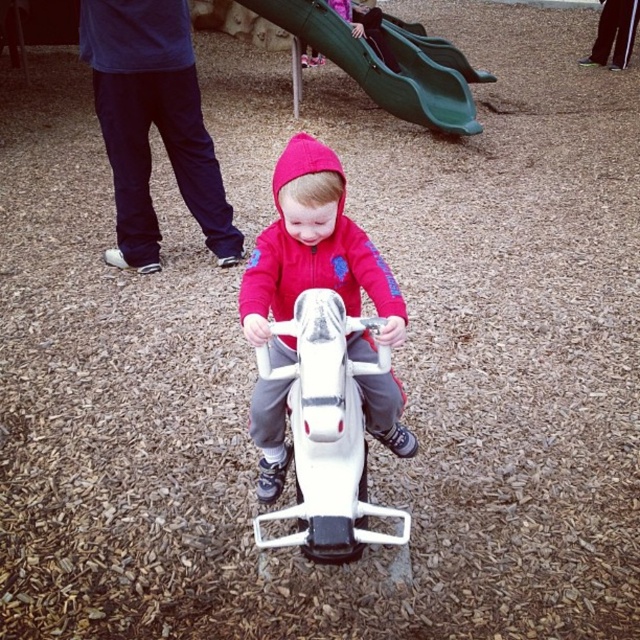
Which is behind, point (288, 272) or point (422, 99)?

The point (422, 99) is more distant.

This screenshot has width=640, height=640. What do you see at coordinates (316, 252) in the screenshot? I see `matte pink hoodie at center` at bounding box center [316, 252].

Identify the location of matte pink hoodie at center. [316, 252].

From the picture: Is white plastic toy car at center above green plastic slide at upper center?

Incorrect, white plastic toy car at center is not positioned above green plastic slide at upper center.

Between white plastic toy car at center and green plastic slide at upper center, which one is positioned higher?

Positioned higher is green plastic slide at upper center.

Does point (346, 480) come farther from viewer compared to point (333, 44)?

No.

This screenshot has height=640, width=640. Find the location of `white plastic toy car at center`. white plastic toy car at center is located at coordinates (326, 433).

Does matte pink hoodie at center appear on the right side of white plastic toy car at center?

Indeed, matte pink hoodie at center is positioned on the right side of white plastic toy car at center.

The width and height of the screenshot is (640, 640). What do you see at coordinates (316, 252) in the screenshot?
I see `matte pink hoodie at center` at bounding box center [316, 252].

The image size is (640, 640). Describe the element at coordinates (316, 252) in the screenshot. I see `matte pink hoodie at center` at that location.

This screenshot has width=640, height=640. Identify the location of matte pink hoodie at center. (316, 252).